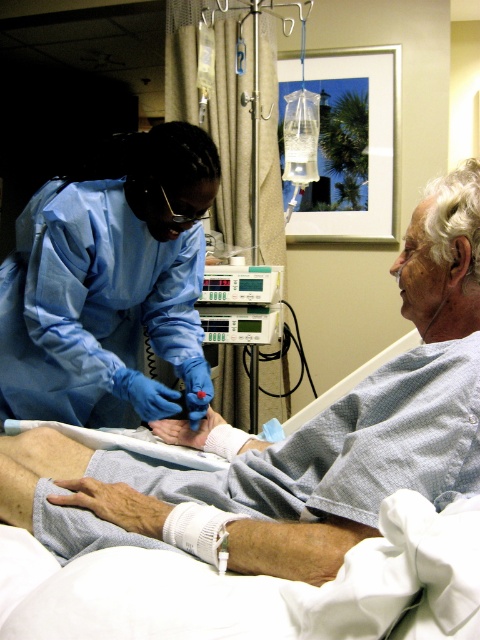
Is blue smooth gloves at upper left closer to camera compared to blue smooth gloves at left?

Yes, blue smooth gloves at upper left is in front of blue smooth gloves at left.

Can you confirm if blue smooth gloves at upper left is taller than blue smooth gloves at left?

No.

Is point (454, 170) positioned after point (208, 193)?

No, (454, 170) is closer to viewer.

At what (x,y) coordinates should I click in order to perform the action: click on blue smooth gloves at upper left. Please return your answer as a coordinate pair (x, y). Image resolution: width=480 pixels, height=640 pixels. Looking at the image, I should click on (291, 440).